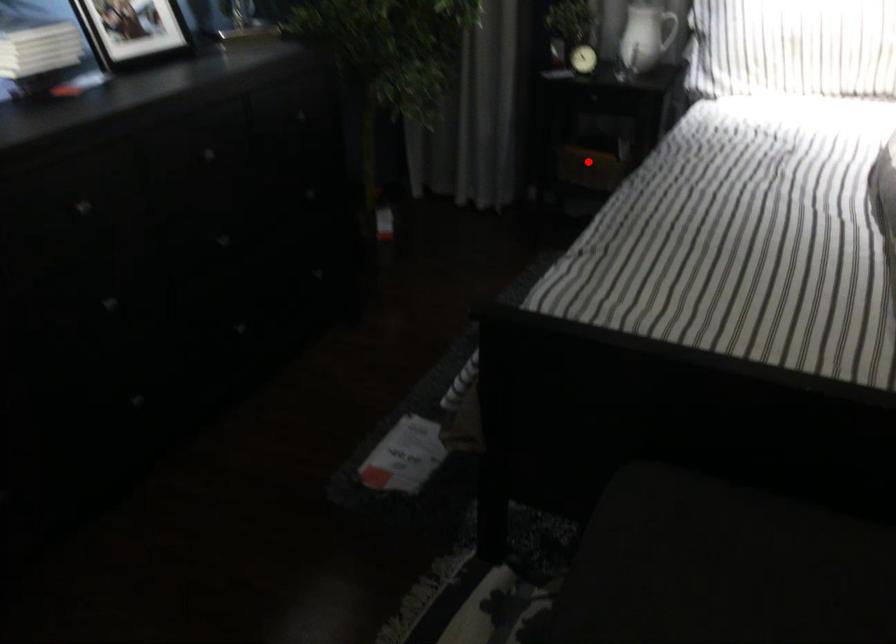
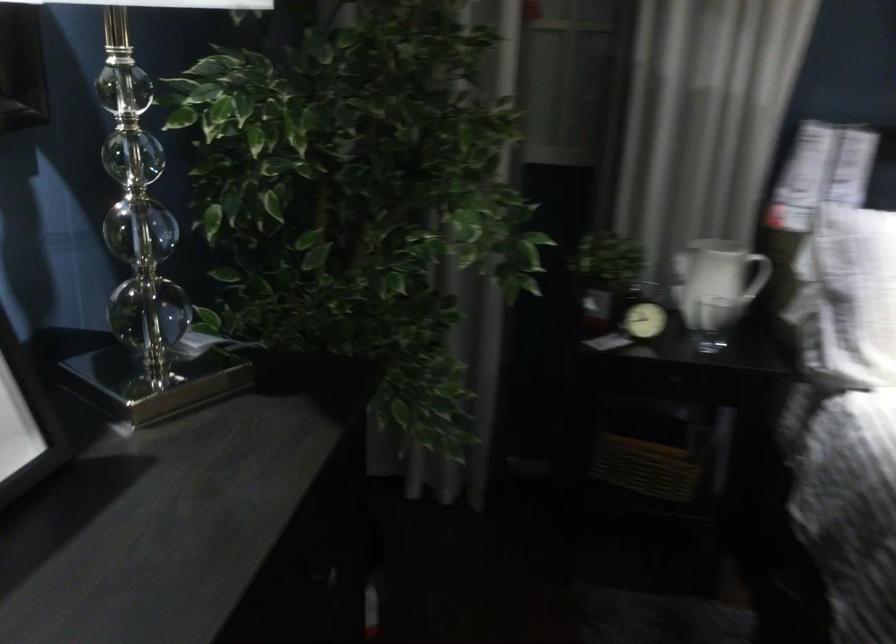
Question: A red point is marked in image1. In image2, is the corresponding 3D point closer to the camera or farther? Reply with the corresponding letter.

Choices:
 (A) The corresponding 3D point is closer.
 (B) The corresponding 3D point is farther.

Answer: (A)